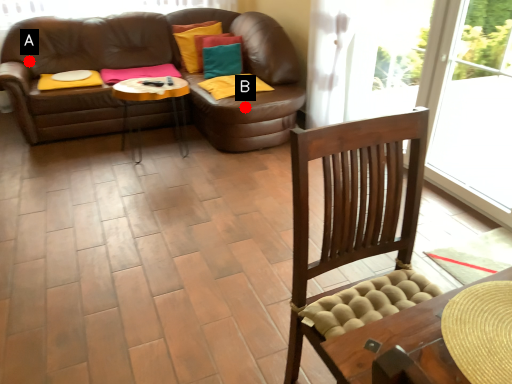
Question: Two points are circled on the image, labeled by A and B beside each circle. Among these points, which one is farthest from the camera?

Choices:
 (A) A is further
 (B) B is further

Answer: (A)